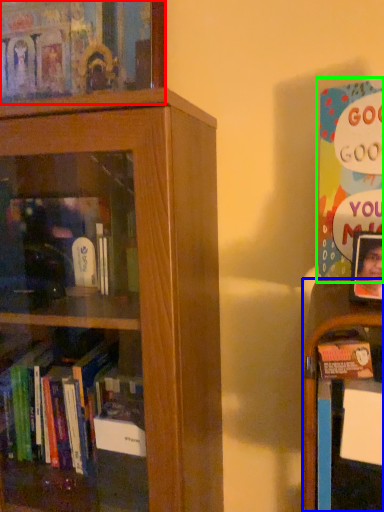
Question: Which object is positioned farthest from book (highlighted by a red box)? Select from shelf (highlighted by a blue box) and book (highlighted by a green box).

Choices:
 (A) shelf
 (B) book

Answer: (A)